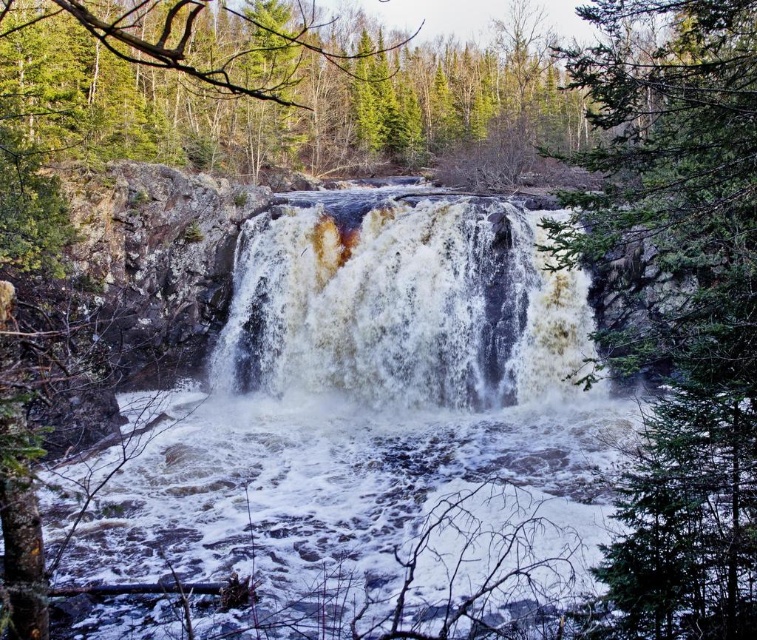
Which is behind, point (603, 196) or point (449, 384)?

Positioned behind is point (449, 384).

Is green textured pine tree at center taller than white frothy water at center?

Yes, green textured pine tree at center is taller than white frothy water at center.

Locate an element on the screen. green textured pine tree at center is located at coordinates (675, 300).

Where is `green textured pine tree at center`? This screenshot has height=640, width=757. green textured pine tree at center is located at coordinates (675, 300).